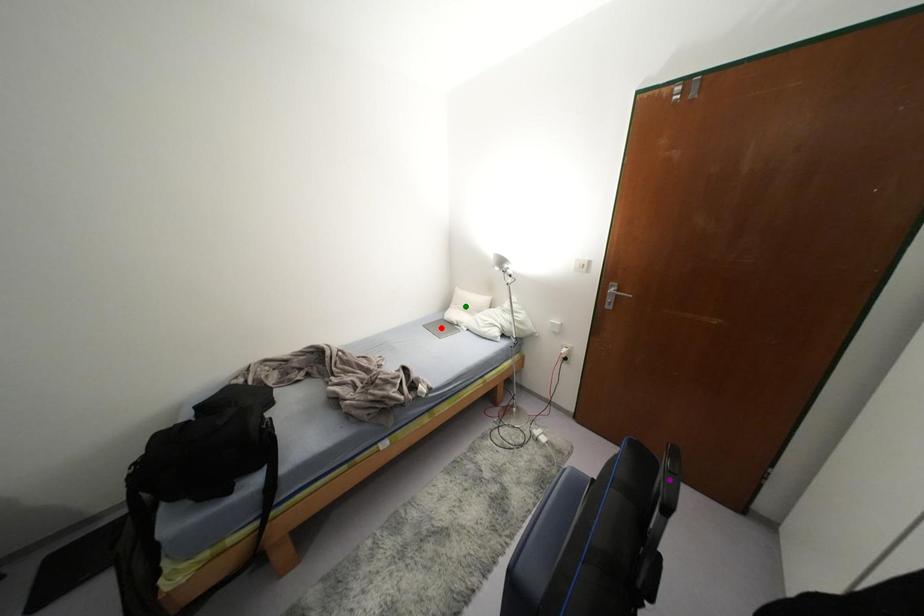
Order these from nearest to farthest:
1. red point
2. purple point
3. green point

purple point < red point < green point